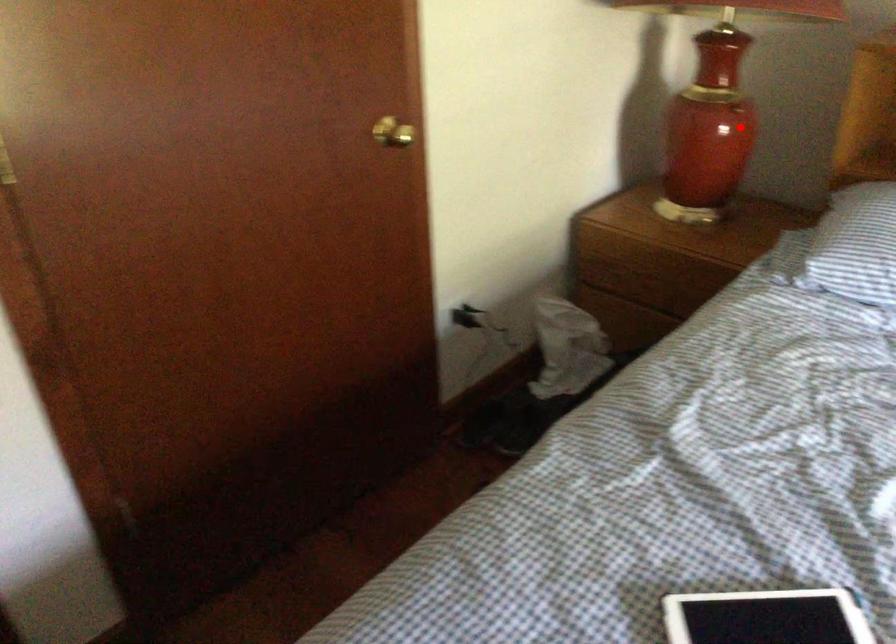
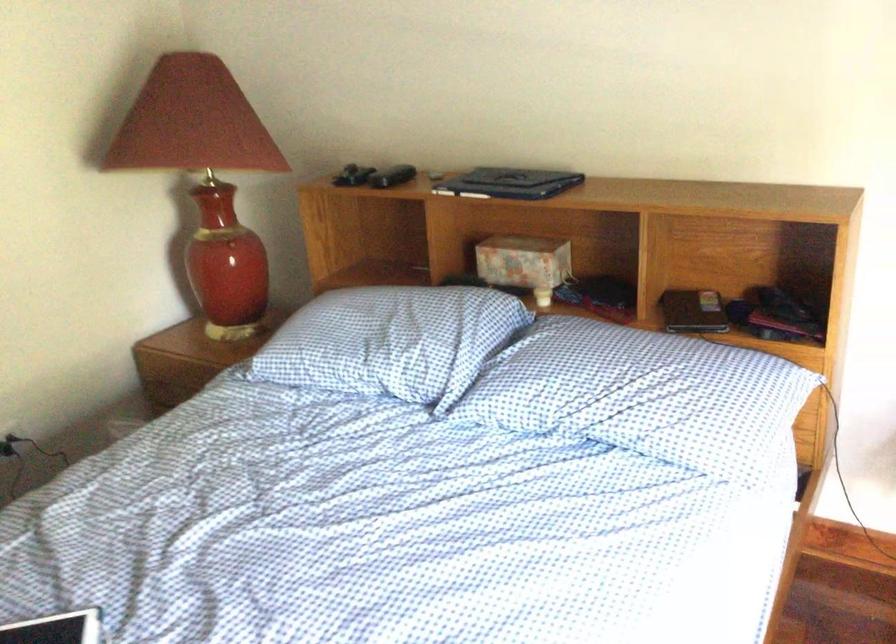
In the second image, find the point that corresponds to the highlighted location in the first image.

(229, 249)